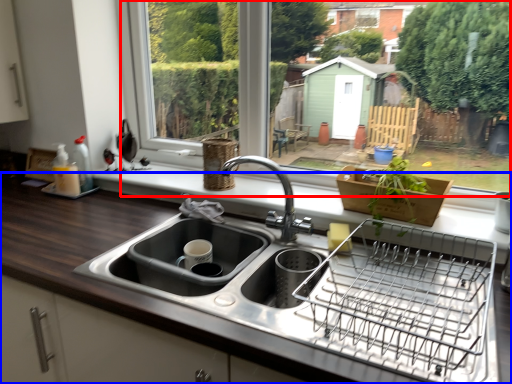
Question: Which of the following is the farthest to the observer, window frame (highlighted by a red box) or countertop (highlighted by a blue box)?

Choices:
 (A) window frame
 (B) countertop

Answer: (A)